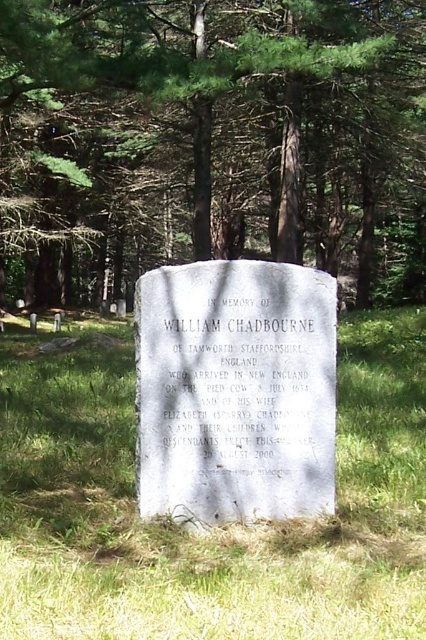
Is point (261, 102) positioned after point (104, 612)?

Yes, it is behind point (104, 612).

Which is more to the left, green leafy tree at center or green grass at center?

green grass at center

Which is behind, point (400, 252) or point (399, 308)?

Point (400, 252)

Locate an element on the screen. This screenshot has height=640, width=426. green leafy tree at center is located at coordinates (212, 140).